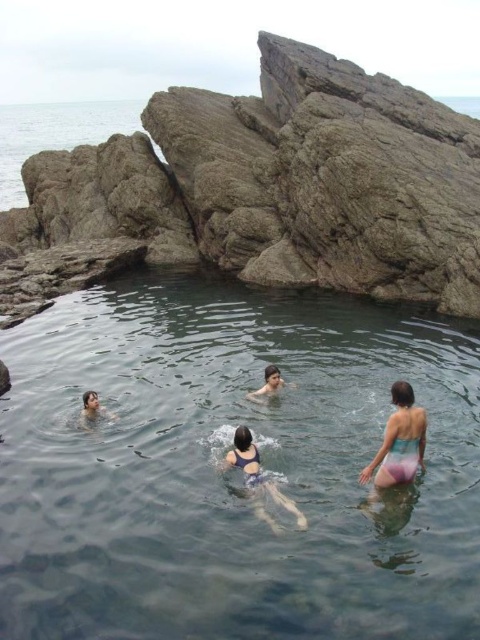
Question: Is gray rough rock at upper center closer to camera compared to multicolored swimsuit at center?

Choices:
 (A) yes
 (B) no

Answer: (B)

Question: Can you confirm if transparent plastic pool at center is smaller than light brown skin at center?

Choices:
 (A) no
 (B) yes

Answer: (A)

Question: Is gray rough rock at upper center to the right of matte black swimmer at lower left from the viewer's perspective?

Choices:
 (A) yes
 (B) no

Answer: (A)

Question: Which object is positioned closest to the gray rough rock at upper center?

Choices:
 (A) solid purple swimsuit at center
 (B) multicolored swimsuit at center
 (C) transparent plastic pool at center
 (D) gray rock at upper left

Answer: (C)

Question: Which point is farther from the camera taking this photo?

Choices:
 (A) (277, 387)
 (B) (20, 195)

Answer: (B)

Question: Which point appears farthest from the camera in this image?

Choices:
 (A) (88, 426)
 (B) (54, 104)
 (C) (252, 483)

Answer: (B)